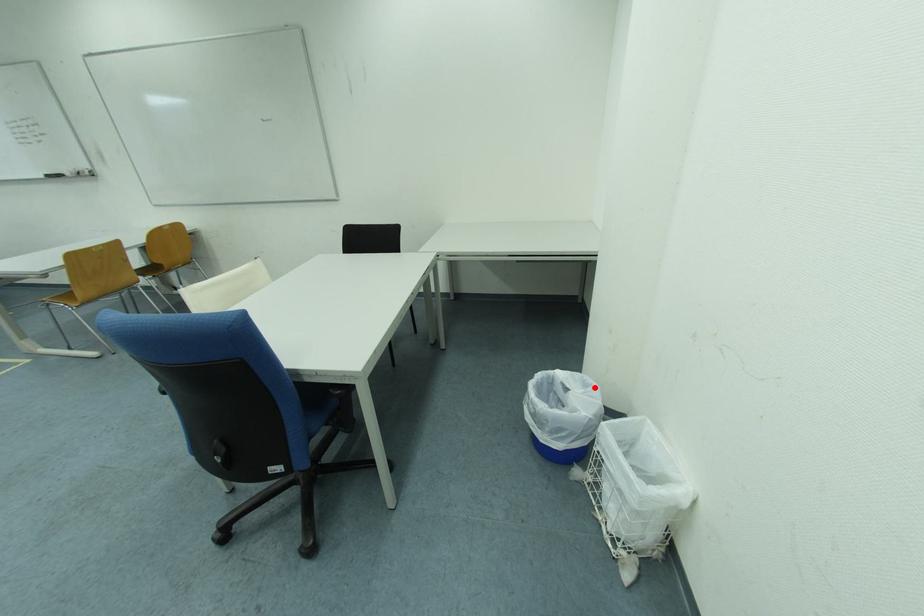
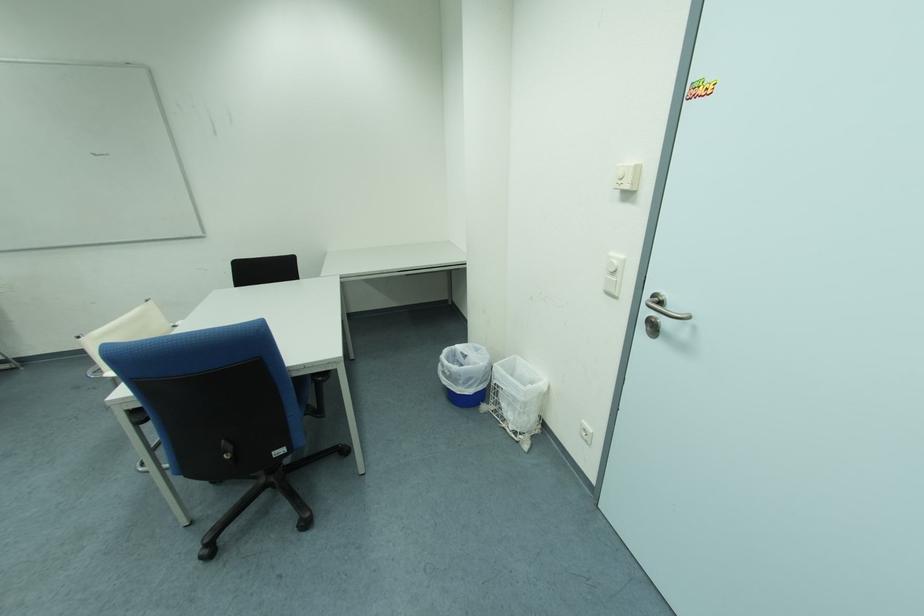
Question: I am providing you with two images of the same scene from different viewpoints. Given a red point in image1, look at the same physical point in image2. Is it:

Choices:
 (A) Closer to the viewpoint
 (B) Farther from the viewpoint

Answer: (B)